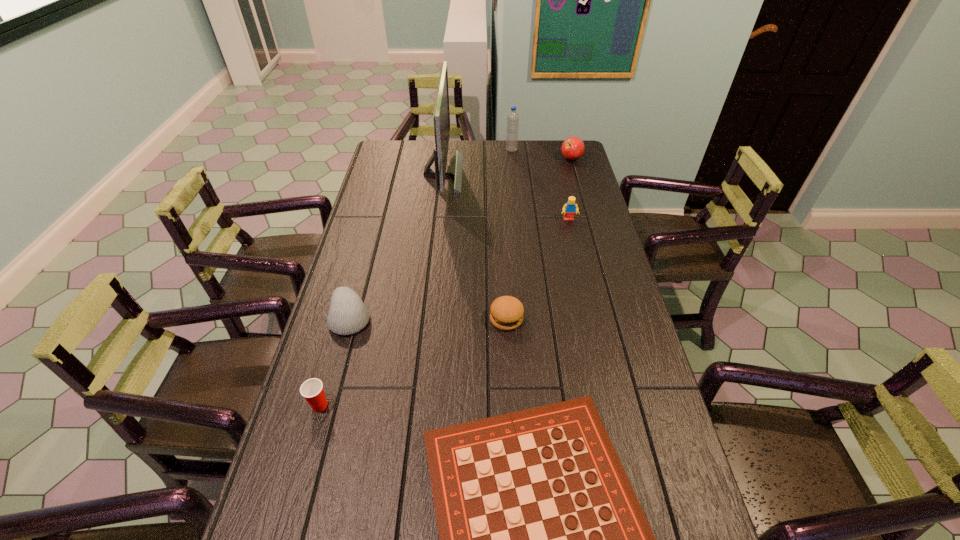
At what (x,y) coordinates should I click in order to perform the action: click on monitor. Please return your answer as a coordinate pair (x, y). Image resolution: width=960 pixels, height=540 pixels. Looking at the image, I should click on pos(441,115).

The width and height of the screenshot is (960, 540). Find the location of `water bottle`. water bottle is located at coordinates (512, 129).

The image size is (960, 540). What are the coordinates of `apple` in the screenshot? It's located at (572, 148).

The width and height of the screenshot is (960, 540). In order to click on the fourth farthest object in this screenshot , I will do `click(569, 209)`.

Where is `beanie`? Image resolution: width=960 pixels, height=540 pixels. beanie is located at coordinates (348, 314).

Where is `Dixie cup`? Dixie cup is located at coordinates (312, 390).

Image resolution: width=960 pixels, height=540 pixels. In order to click on the second shortest object in this screenshot , I will do `click(506, 312)`.

Where is `free spot located on the screen side of the tallest object`? Image resolution: width=960 pixels, height=540 pixels. free spot located on the screen side of the tallest object is located at coordinates click(478, 172).

What are the coordinates of `free location located 0.220m on the right of the second tallest object` in the screenshot? It's located at (564, 150).

Where is `free space located on the left of the apple`? The width and height of the screenshot is (960, 540). free space located on the left of the apple is located at coordinates (500, 159).